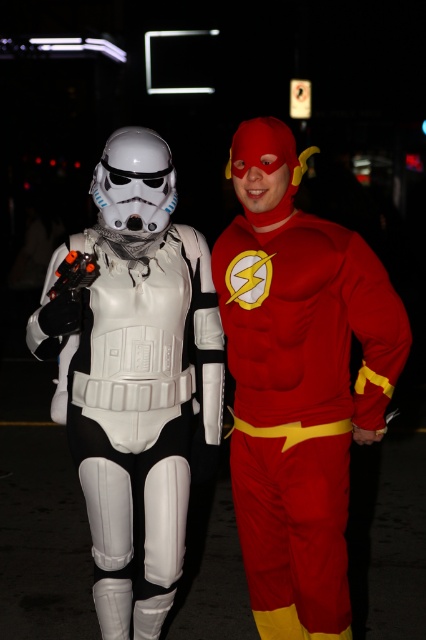
In the scene shown: You are planning to take a photo of the matte white armor at left and the rubberized red suit at center. To ensure both are fully visible in the frame, which object should you position closer to the camera?

The matte white armor at left might be wider than the rubberized red suit at center, so positioning the matte white armor at left closer to the camera would help ensure both objects fit within the frame.

You are a photographer standing in front of the matte white armor at left. You want to take a closeup shot of the Stormtrooper helmet. Based on the distance provided, can you estimate if you can capture the entire helmet in your shot without moving closer?

The matte white armor at left is 9.57 feet away from the viewer. To determine if the entire helmet can be captured, consider your camera lens and sensor size. A standard lens might require being closer, but if using a wide angle or appropriate settings, it could fit. However, without specific equipment details, it is uncertain.